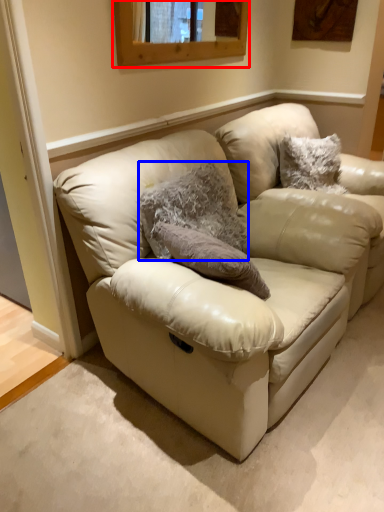
Question: Which object appears farthest to the camera in this image, window (highlighted by a red box) or animal (highlighted by a blue box)?

Choices:
 (A) window
 (B) animal

Answer: (A)